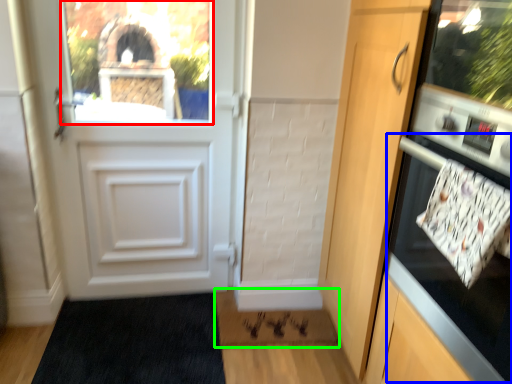
Question: Estimate the real-world distances between objects in this image. Which object is farther from window screen (highlighted by a red box), oven (highlighted by a blue box) or doormat (highlighted by a green box)?

Choices:
 (A) oven
 (B) doormat

Answer: (A)